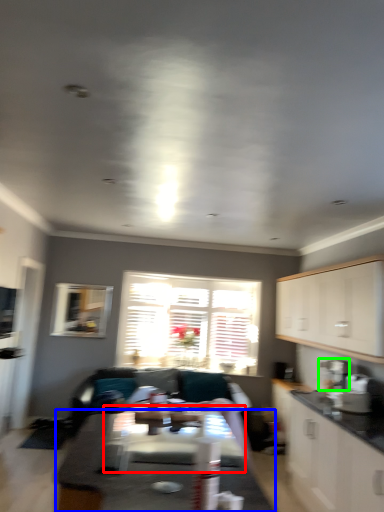
Question: Estimate the real-world distances between objects in this image. Which object is farther from table (highlighted by a red box), table (highlighted by a blue box) or appliance (highlighted by a green box)?

Choices:
 (A) table
 (B) appliance

Answer: (B)